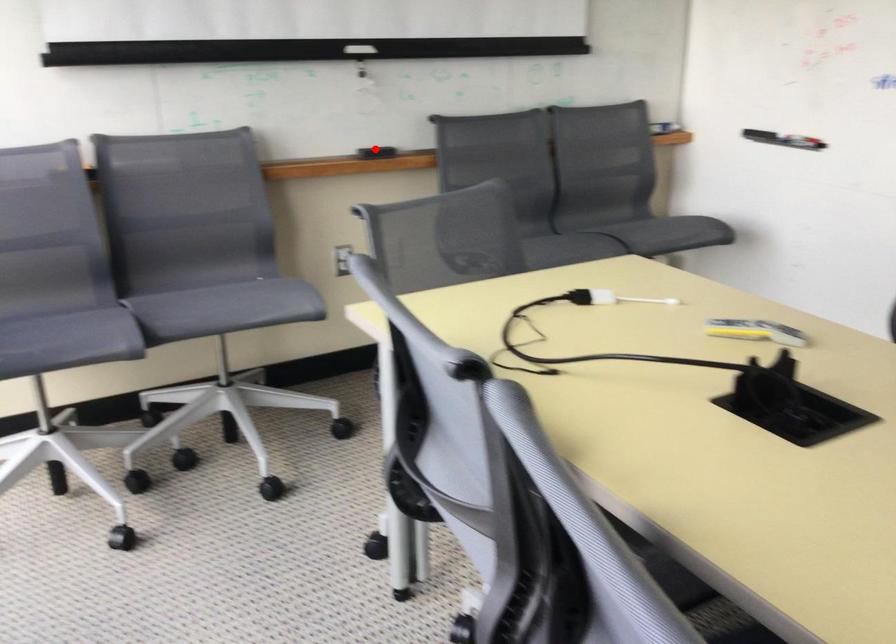
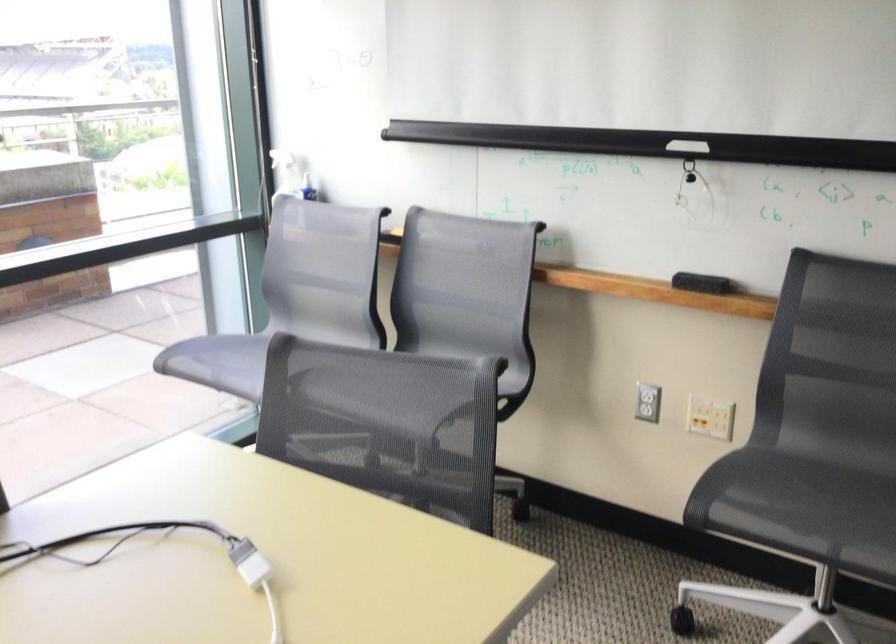
Question: I am providing you with two images of the same scene from different viewpoints. A red point is marked on the first image. Can you still see the location of the red point in image 2?

Choices:
 (A) Yes
 (B) No

Answer: (A)